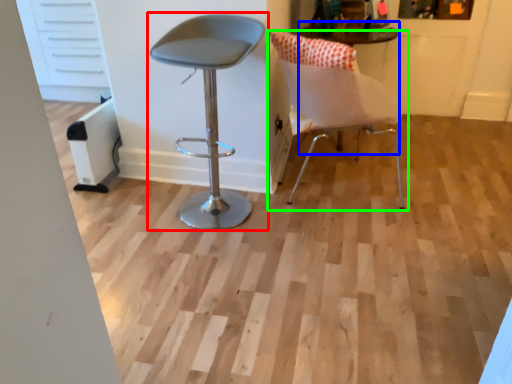
Question: Which object is the farthest from chair (highlighted by a red box)? Choose among these: round table (highlighted by a blue box) or chair (highlighted by a green box).

Choices:
 (A) round table
 (B) chair

Answer: (A)